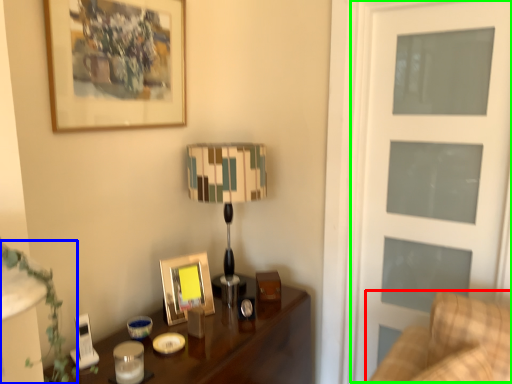
Question: Which object is positioned farthest from furniture (highlighted by a red box)? Select from plant (highlighted by a blue box) and screen door (highlighted by a green box).

Choices:
 (A) plant
 (B) screen door

Answer: (A)